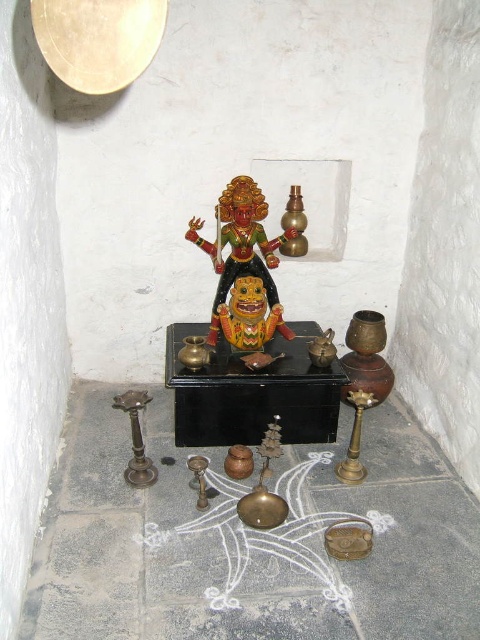
Question: Which point is closer to the camera?

Choices:
 (A) pyautogui.click(x=180, y=416)
 (B) pyautogui.click(x=216, y=252)

Answer: (A)

Question: Is black polished altar at center below glossy painted deity at center?

Choices:
 (A) no
 (B) yes

Answer: (B)

Question: Can you confirm if black polished altar at center is positioned below glossy painted deity at center?

Choices:
 (A) yes
 (B) no

Answer: (A)

Question: Does black polished altar at center come in front of glossy painted deity at center?

Choices:
 (A) no
 (B) yes

Answer: (B)

Question: Which point appears closest to the camera in this image?

Choices:
 (A) (240, 252)
 (B) (261, 374)

Answer: (B)